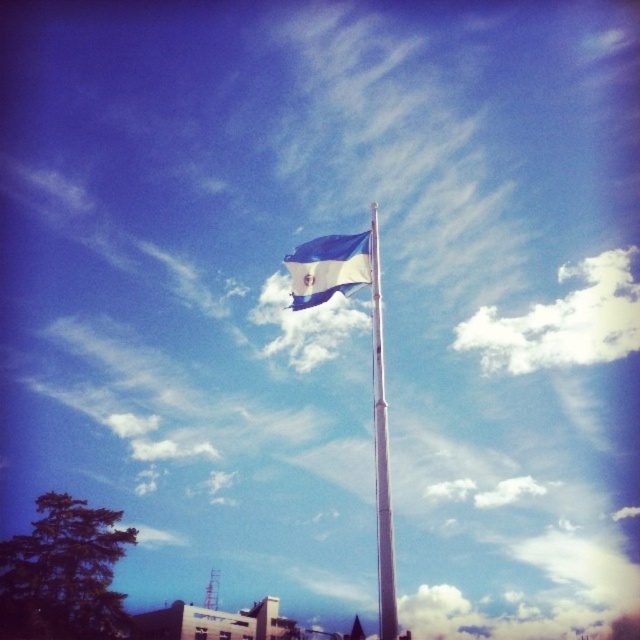
You are a city planner assessing the flagpole and flag placement. Given the height of the white metallic pole at center and the blue fabric flag at upper center, which one is more likely to interfere with low flying aircraft in this urban area?

The white metallic pole at center is much taller than the blue fabric flag at upper center, so the white metallic pole at center is more likely to interfere with low flying aircraft in this urban area.

You are a photographer aiming to capture the white metallic pole at center and the blue fabric flag at upper center in a single shot. Based on their positions, which object will appear closer to the bottom of the photo?

The white metallic pole at center is located below the blue fabric flag at upper center, so it will appear closer to the bottom of the photo.